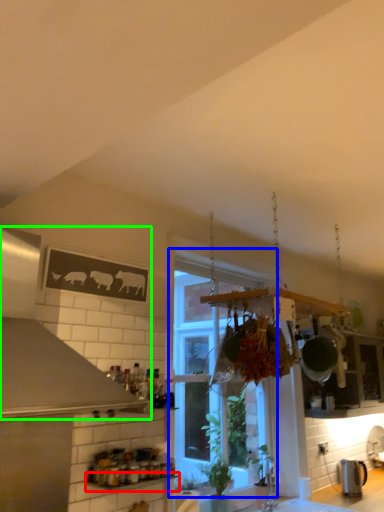
Question: Estimate the real-world distances between objects in this image. Which object is closer to window sill (highlighted by a red box), window (highlighted by a blue box) or exhaust hood (highlighted by a green box)?

Choices:
 (A) window
 (B) exhaust hood

Answer: (B)